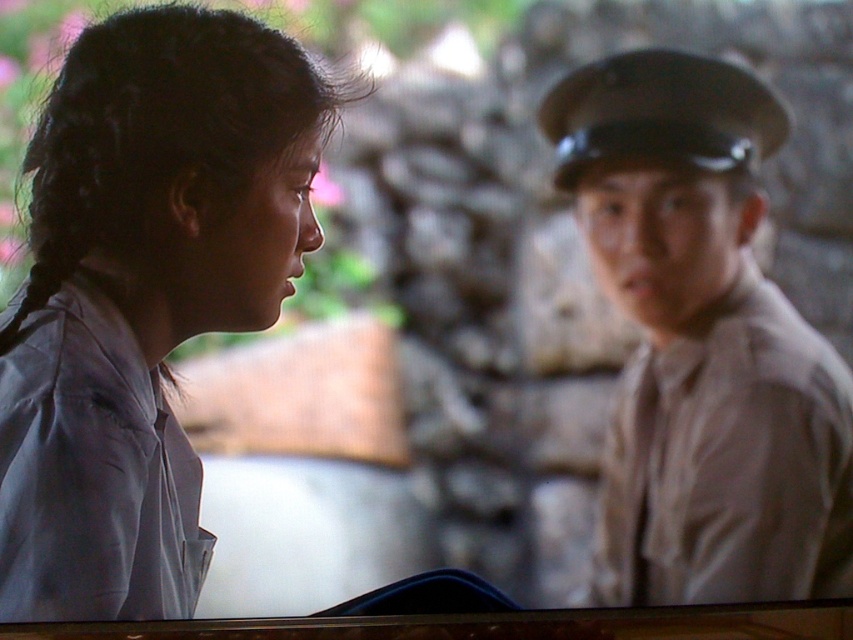
You are a person standing in the scene. You need to place a small sticker exactly at the point with coordinates point (142, 296). Which object from the scene should you look for to place the sticker correctly?

The point (142, 296) is located on the matte gray shirt at left, so you should place the sticker there.

You are designing a layout for a magazine article about military attire and need to place two images side by side. One image shows the matte gray shirt at left, and the other shows the matte gray uniform at left. To ensure visual balance, which item should be placed higher on the page?

The matte gray shirt at left should be placed higher on the page because it has a greater height compared to the matte gray uniform at left, creating a balanced layout.

You are standing in the room where the two people are talking. You need to move from the point at coordinates point (677, 477) to the point at coordinates point (4, 426). Which direction should you move to reach the second point?

To move from point (677, 477) to point (4, 426), you should move downward and to the left since point (4, 426) is located below and to the left of point (677, 477).